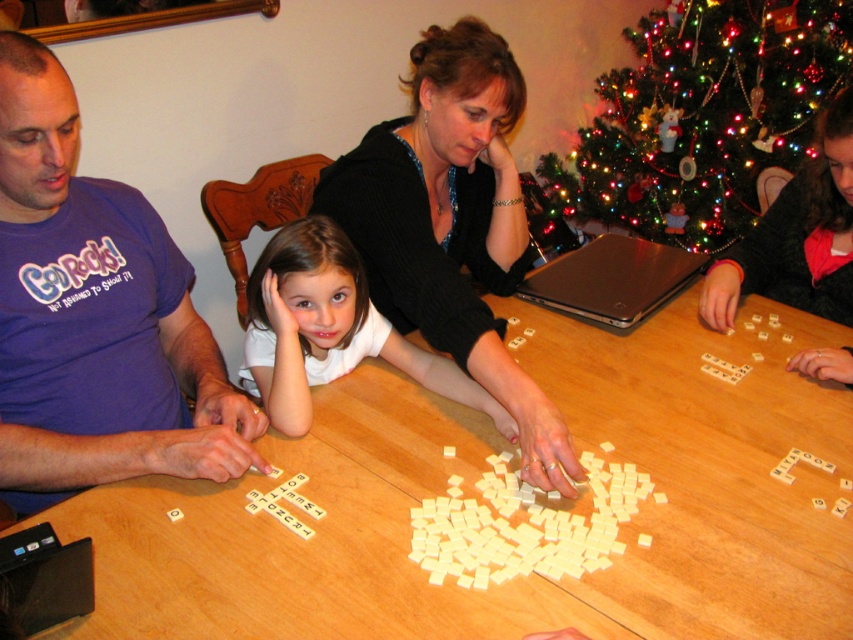
Question: Can you confirm if green matte christmas tree at upper center is positioned to the right of smooth black sweater at center?

Choices:
 (A) no
 (B) yes

Answer: (B)

Question: Does green matte christmas tree at upper center appear under smooth black sweater at center?

Choices:
 (A) no
 (B) yes

Answer: (A)

Question: Which point is farther from the camera taking this photo?

Choices:
 (A) (352, 278)
 (B) (252, 512)
 (C) (567, 496)

Answer: (A)

Question: Which of the following is the farthest from the observer?

Choices:
 (A) white plastic letter tiles at center
 (B) white matte/soft child at center

Answer: (B)

Question: Can you confirm if wooden table at center is positioned above black sweater at center?

Choices:
 (A) yes
 (B) no

Answer: (B)

Question: Which point is closer to the camera?

Choices:
 (A) (670, 108)
 (B) (277, 515)
 (C) (0, 172)
 (D) (415, 515)

Answer: (D)